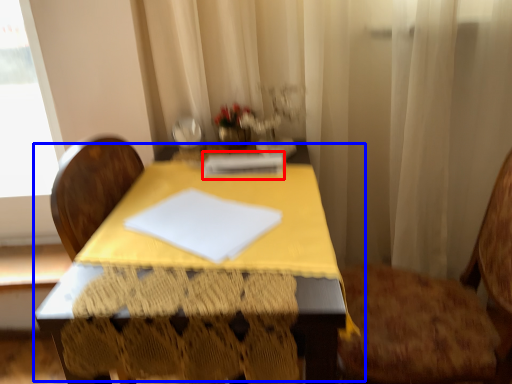
Question: Which of the following is the closest to the observer, notebook (highlighted by a red box) or table (highlighted by a blue box)?

Choices:
 (A) notebook
 (B) table

Answer: (B)